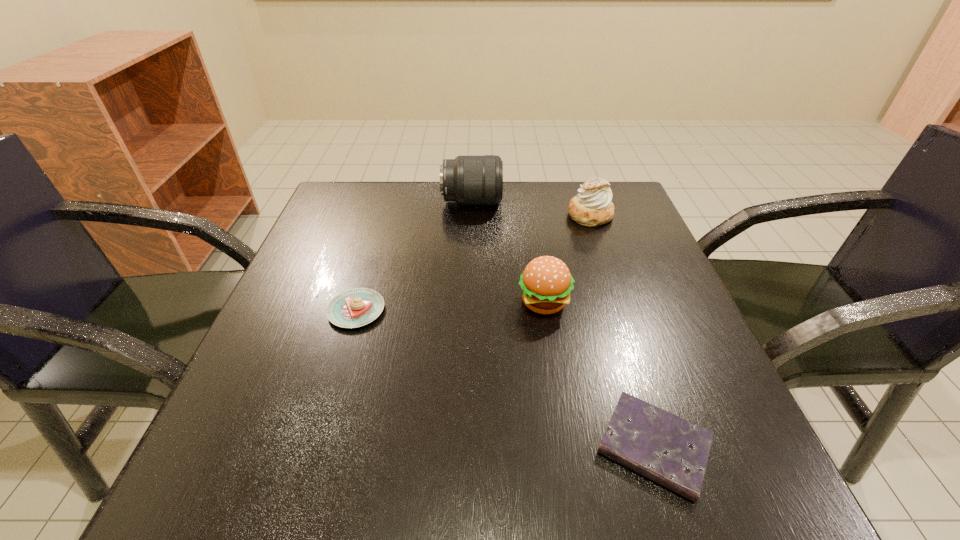
Where is `telephoto lens`? This screenshot has height=540, width=960. telephoto lens is located at coordinates (468, 180).

I want to click on the second object from left to right, so click(x=468, y=180).

Locate an element on the screen. This screenshot has height=540, width=960. the right pastry is located at coordinates (592, 207).

This screenshot has height=540, width=960. Find the location of `the farther pastry`. the farther pastry is located at coordinates tap(592, 207).

The image size is (960, 540). I want to click on hamburger, so click(x=546, y=283).

This screenshot has width=960, height=540. Identify the location of the nearer pastry. (356, 307).

Image resolution: width=960 pixels, height=540 pixels. In order to click on the second shortest object in this screenshot , I will do `click(356, 307)`.

Locate an element on the screen. the nearest object is located at coordinates (667, 449).

The width and height of the screenshot is (960, 540). Identify the location of the shortest object. (667, 449).

Locate an element on the screen. The image size is (960, 540). vacant space located 0.170m on the surface of the second object from left to right is located at coordinates (570, 201).